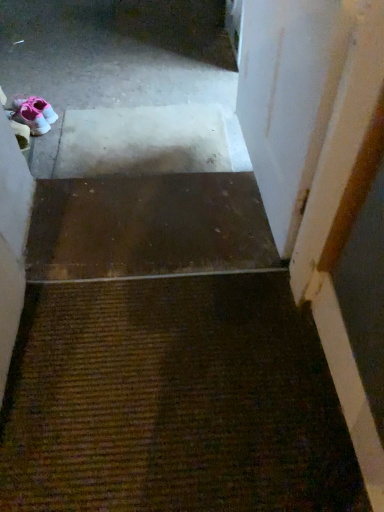
Question: From a real-world perspective, is pink fabric sneakers at upper left physically below brown matte stair at center?

Choices:
 (A) no
 (B) yes

Answer: (B)

Question: Is pink fabric sneakers at upper left thinner than brown matte stair at center?

Choices:
 (A) no
 (B) yes

Answer: (B)

Question: Is pink fabric sneakers at upper left to the left of brown matte stair at center from the viewer's perspective?

Choices:
 (A) no
 (B) yes

Answer: (B)

Question: Can you confirm if pink fabric sneakers at upper left is bigger than brown matte stair at center?

Choices:
 (A) yes
 (B) no

Answer: (B)

Question: Is pink fabric sneakers at upper left positioned in front of brown matte stair at center?

Choices:
 (A) yes
 (B) no

Answer: (B)

Question: From a real-world perspective, is brown textured mat at center physically located above or below white matte door at upper right?

Choices:
 (A) above
 (B) below

Answer: (B)

Question: Is point (148, 442) closer or farther from the camera than point (336, 41)?

Choices:
 (A) closer
 (B) farther

Answer: (B)

Question: In the image, is brown textured mat at center positioned in front of or behind white matte door at upper right?

Choices:
 (A) behind
 (B) front

Answer: (A)

Question: Is brown textured mat at center bigger or smaller than white matte door at upper right?

Choices:
 (A) big
 (B) small

Answer: (B)

Question: Is pink fabric sneakers at upper left in front of or behind brown textured mat at center in the image?

Choices:
 (A) front
 (B) behind

Answer: (B)

Question: In terms of width, does pink fabric sneakers at upper left look wider or thinner when compared to brown textured mat at center?

Choices:
 (A) wide
 (B) thin

Answer: (B)

Question: Choose the correct answer: Is pink fabric sneakers at upper left inside brown textured mat at center or outside it?

Choices:
 (A) inside
 (B) outside

Answer: (B)

Question: From a real-world perspective, relative to brown textured mat at center, is pink fabric sneakers at upper left vertically above or below?

Choices:
 (A) above
 (B) below

Answer: (B)

Question: Is brown textured mat at center bigger or smaller than brown matte stair at center?

Choices:
 (A) small
 (B) big

Answer: (B)

Question: In terms of height, does brown textured mat at center look taller or shorter compared to brown matte stair at center?

Choices:
 (A) short
 (B) tall

Answer: (B)